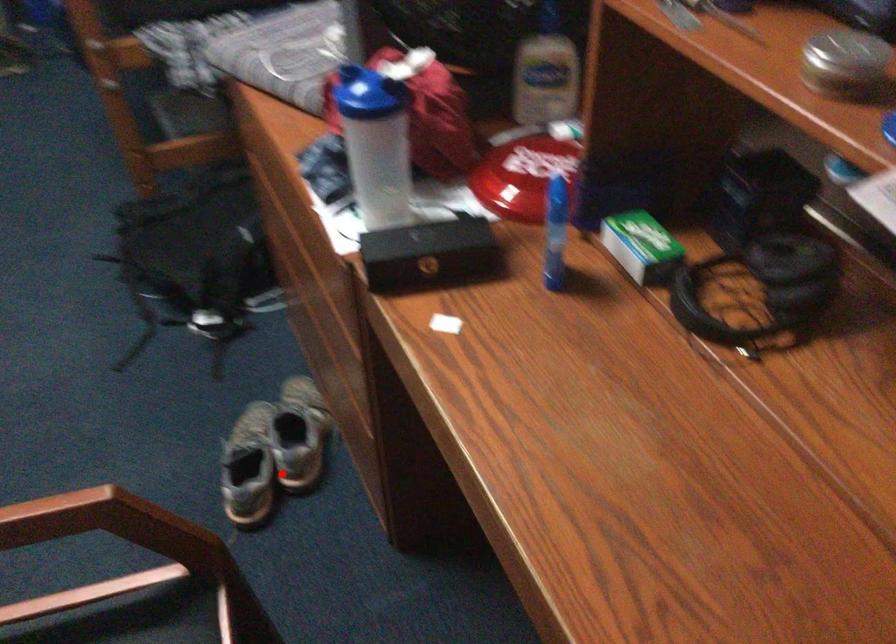
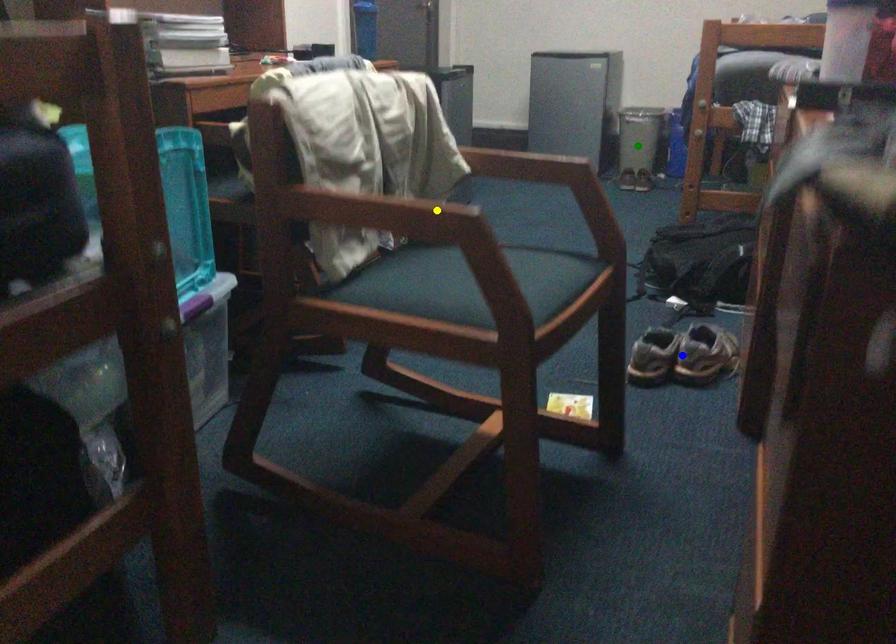
Question: I am providing you with two images of the same scene from different viewpoints. A red point is marked on the first image. You are given multiple points on the second image. In image 2, which mark is for the same physical point as the one in image 1?

Choices:
 (A) yellow point
 (B) green point
 (C) blue point

Answer: (C)